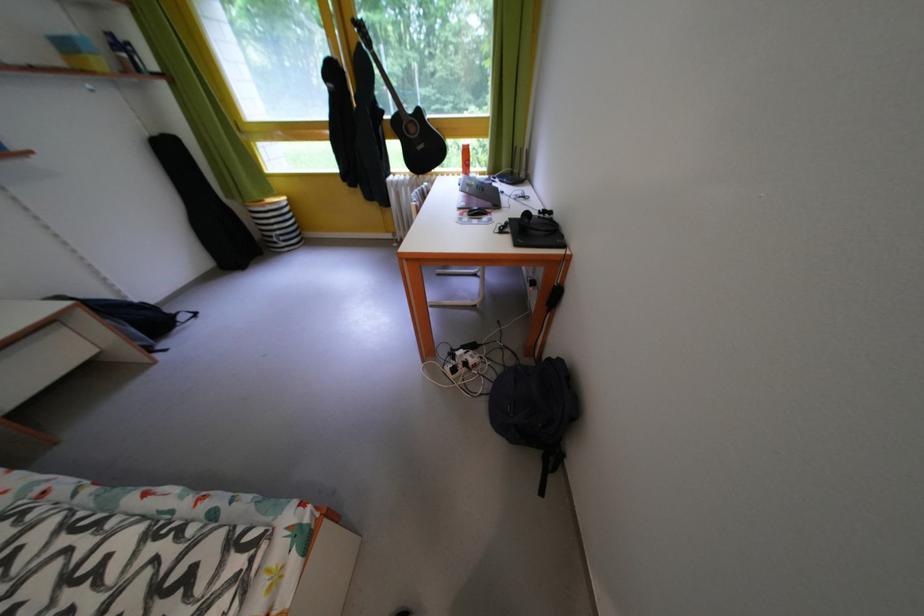
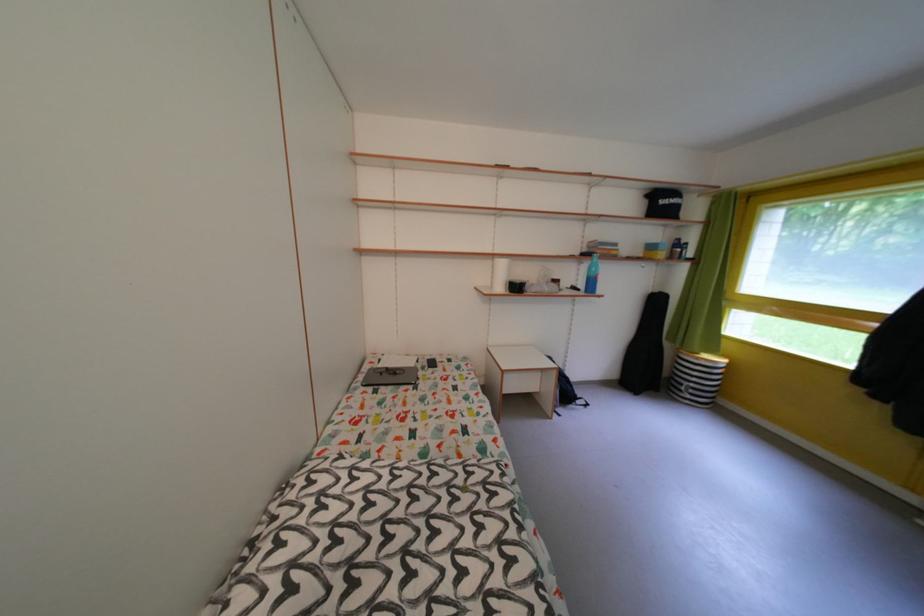
Where in the second image is the point corresponding to point 165,139 from the first image?

(665, 296)